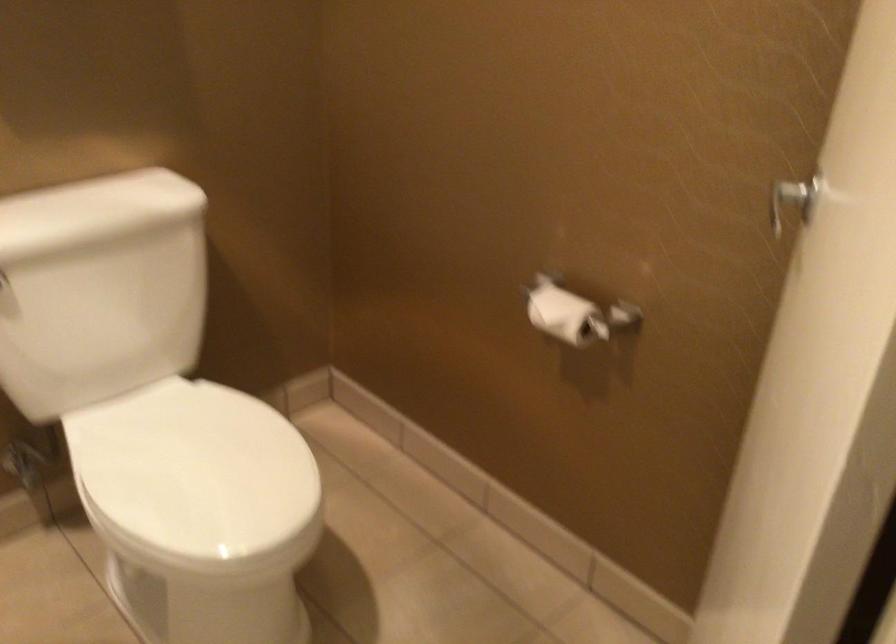
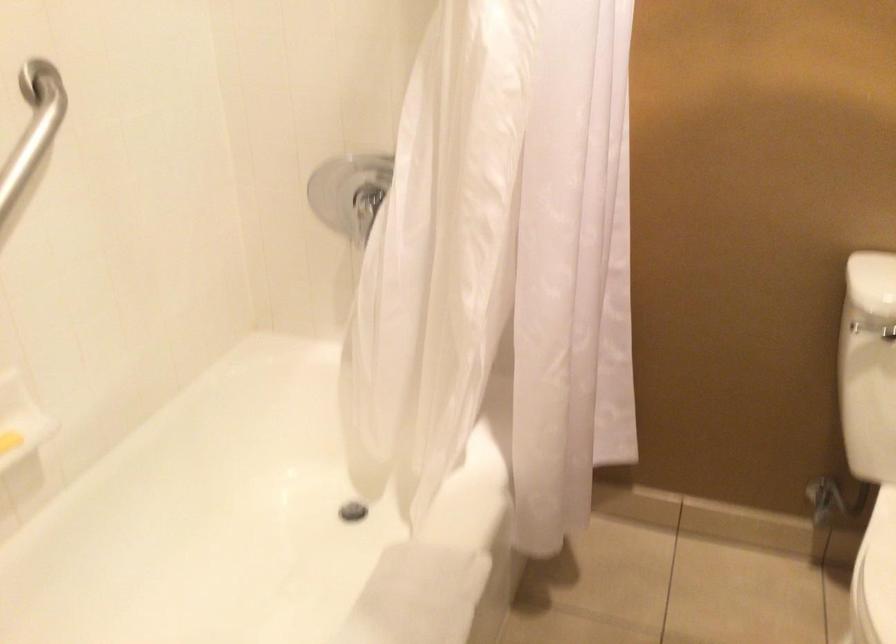
Question: The camera is either moving clockwise (left) or counter-clockwise (right) around the object. The first image is from the beginning of the video and the second image is from the end. Is the camera moving left or right when shooting the video?

Choices:
 (A) Left
 (B) Right

Answer: (B)